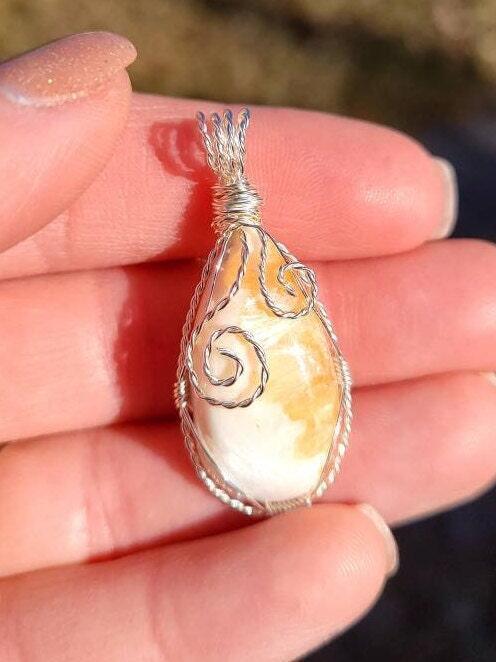
Locate an element on the screen. shadow of pendant is located at coordinates (160, 343), (198, 208), (168, 438).